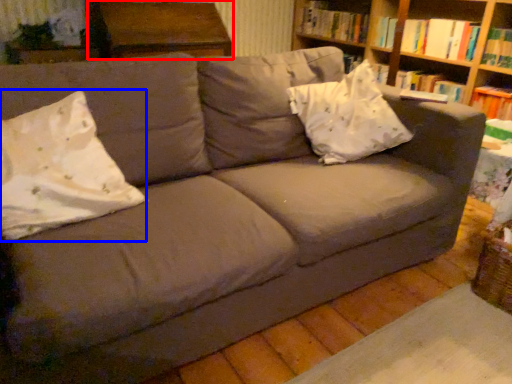
Question: Which of the following is the closest to the observer, table (highlighted by a red box) or throw pillow (highlighted by a blue box)?

Choices:
 (A) table
 (B) throw pillow

Answer: (B)